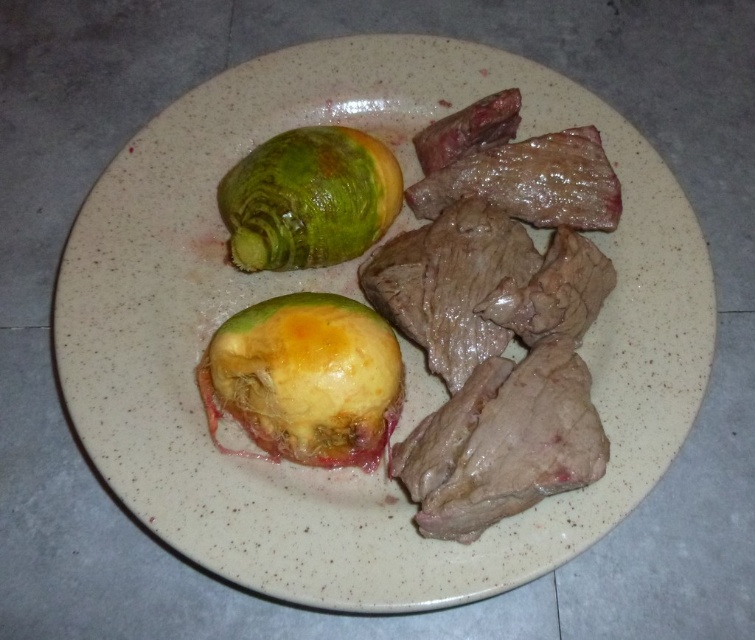
Is yellowish matte fruit at center wider than green matte avocado at upper left?

Yes.

Is yellowish matte fruit at center shorter than green matte avocado at upper left?

Incorrect, yellowish matte fruit at center's height does not fall short of green matte avocado at upper left's.

Where is `yellowish matte fruit at center`? This screenshot has height=640, width=755. yellowish matte fruit at center is located at coordinates (307, 378).